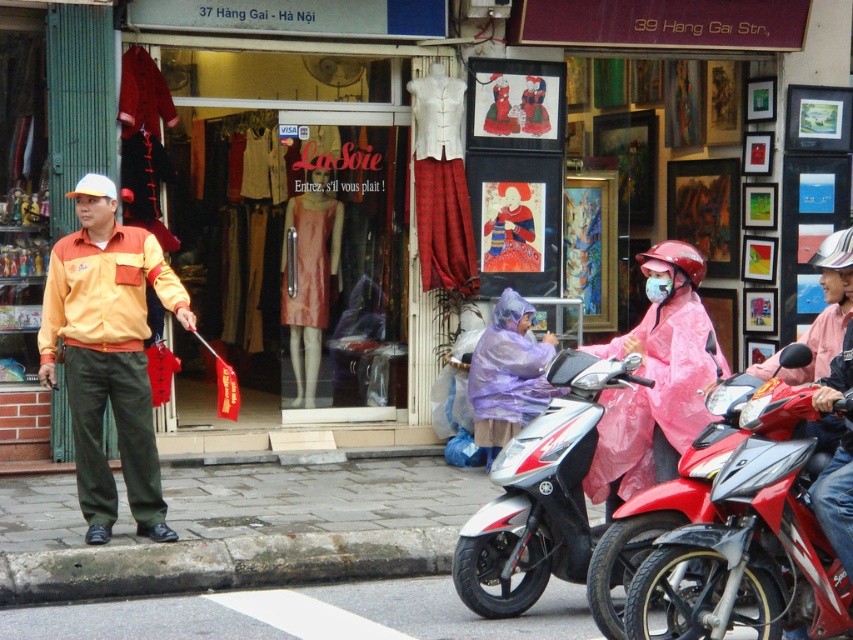
You are a delivery person who needs to park your red glossy motorcycle at right next to the purple matte raincoat at center. Is there enough space between them to fit a 1.2 meter wide delivery cart?

The red glossy motorcycle at right might be wider than the purple matte raincoat at center, so there may not be enough space to fit a 1.2 meter wide delivery cart between them. Check the actual width before attempting to park.

You are a delivery person with a package for the shop. You see the orange fabric shirt at left and the white glossy scooter at center. Which object is wider?

The white glossy scooter at center is wider than the orange fabric shirt at left.